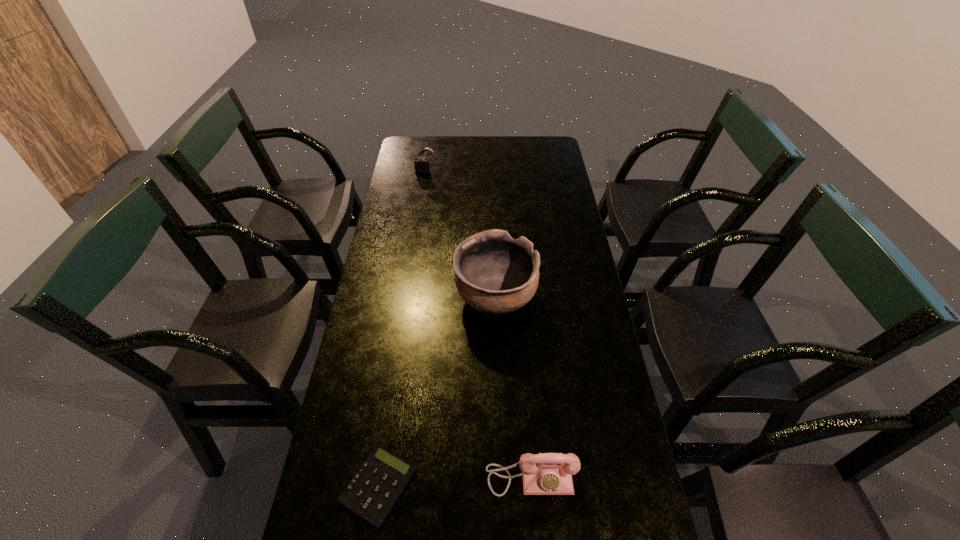
This screenshot has width=960, height=540. I want to click on pottery, so click(495, 274).

At what (x,y) coordinates should I click in order to perform the action: click on the tallest object. Please return your answer as a coordinate pair (x, y). The image size is (960, 540). Looking at the image, I should click on [495, 274].

You are a GUI agent. You are given a task and a screenshot of the screen. Output one action in this format:
    pyautogui.click(x=<x>, y=<y>)
    Task: Click on the padlock
    Image resolution: width=960 pixels, height=540 pixels.
    Given the screenshot: What is the action you would take?
    pyautogui.click(x=421, y=165)

The image size is (960, 540). I want to click on telephone, so click(545, 473).

Where is `the shortest object`? Image resolution: width=960 pixels, height=540 pixels. the shortest object is located at coordinates (376, 486).

You are a GUI agent. You are given a task and a screenshot of the screen. Output one action in this format:
    pyautogui.click(x=<x>, y=<y>)
    Task: Click on the free space located 0.240m on the left of the pottery
    
    Given the screenshot: What is the action you would take?
    pos(380,298)

Image resolution: width=960 pixels, height=540 pixels. What are the coordinates of `vacant space located 0.310m with the keyhole on the front of the farthest object` in the screenshot? It's located at (419, 219).

Locate an element on the screen. The height and width of the screenshot is (540, 960). blank area located on the dial of the telephone is located at coordinates tap(535, 532).

The height and width of the screenshot is (540, 960). What are the coordinates of `free space located 0.270m on the right of the calculator` in the screenshot? It's located at (532, 485).

This screenshot has height=540, width=960. Find the location of `padlock at the left edge`. padlock at the left edge is located at coordinates (421, 165).